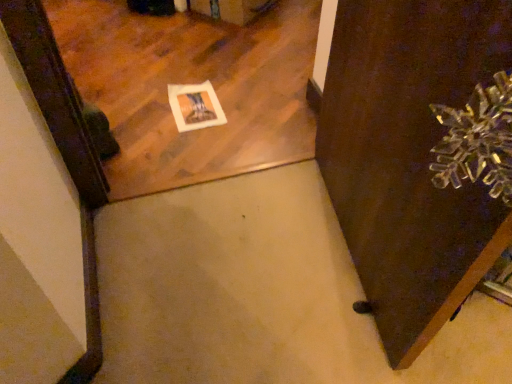
The image size is (512, 384). Identify the location of vacant area that is in front of brown wooden door at right. (341, 334).